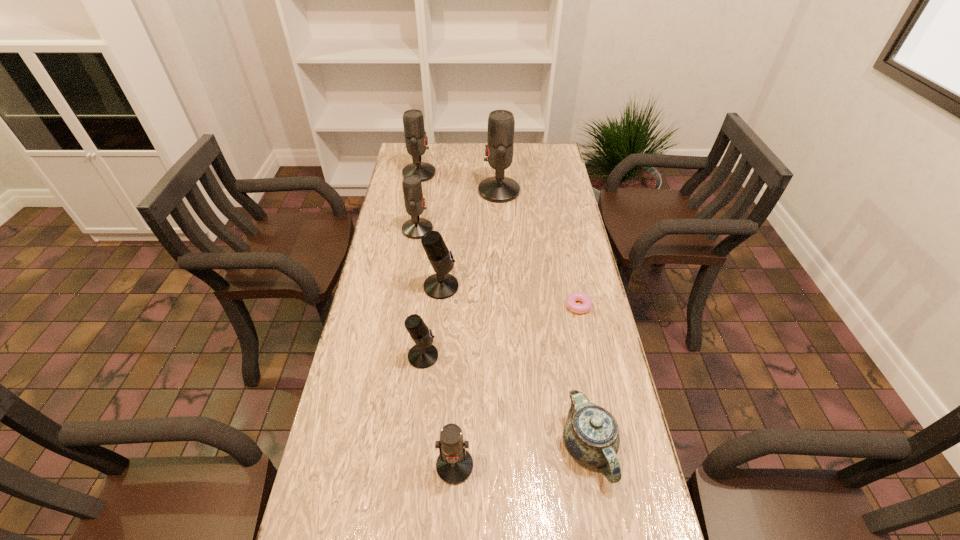
In order to click on the third object from right to left in this screenshot , I will do `click(501, 124)`.

What are the coordinates of `the rightmost red microphone` in the screenshot? It's located at (501, 124).

At what (x,y) coordinates should I click in order to perform the action: click on the second tallest microphone. Please return your answer as a coordinate pair (x, y). This screenshot has width=960, height=540. Looking at the image, I should click on (413, 121).

At what (x,y) coordinates should I click in order to perform the action: click on the seventh shortest object. Please return your answer as a coordinate pair (x, y). The height and width of the screenshot is (540, 960). Looking at the image, I should click on (413, 121).

Locate an element on the screen. the bigger black microphone is located at coordinates (441, 285).

At what (x,y) coordinates should I click in order to perform the action: click on the third nearest microphone. Please return your answer as a coordinate pair (x, y). The height and width of the screenshot is (540, 960). Looking at the image, I should click on (441, 285).

Locate an element on the screen. the sixth nearest object is located at coordinates (416, 227).

Identify the location of the second nearest red microphone. (416, 227).

This screenshot has width=960, height=540. In order to click on the fifth farthest microphone in this screenshot , I will do `click(423, 355)`.

What are the coordinates of `the nearer black microphone` in the screenshot? It's located at (423, 355).